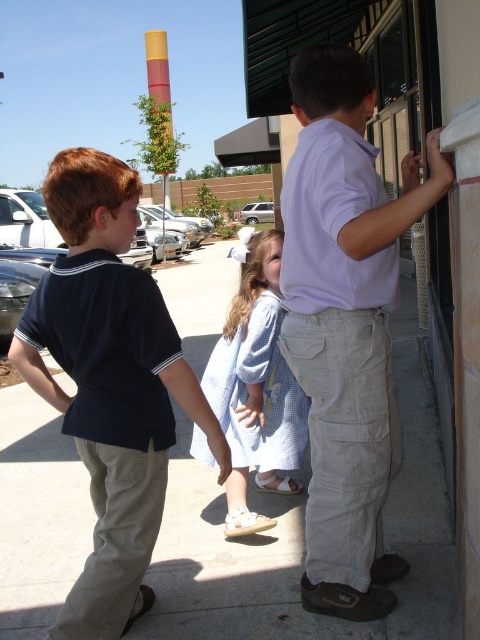
What object is located at the coordinates point (109, 384)?

The point (109, 384) corresponds to the dark blue cotton shirt at left.

You are a maintenance worker needing to place a 1.5 meter long safety barrier between the light gray concrete pavement at center and the light purple shirt at upper right. Based on the distance provided, will the barrier fit without overlapping either object?

The distance between the light gray concrete pavement at center and the light purple shirt at upper right is 1.47 meters. Since the barrier is 1.5 meters long, it will not fit as it exceeds the available space by 0.03 meters.

You are standing at the center of the image. Which direction should you move to find the dark blue cotton shirt at left?

Since the dark blue cotton shirt at left is located at point 0.600 on the x axis and 0.229 on the y axis, you should move to the left and slightly downward from the center to reach it.